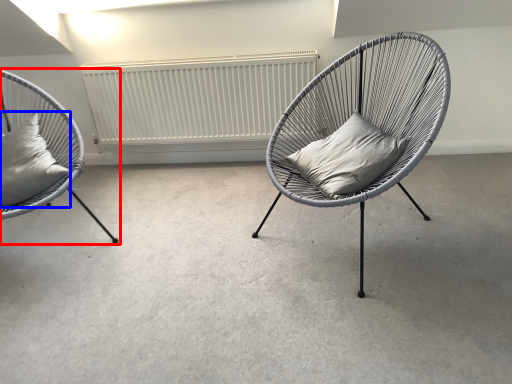
Question: Which point is further to the camera, chair (highlighted by a red box) or pillow (highlighted by a blue box)?

Choices:
 (A) chair
 (B) pillow

Answer: (B)